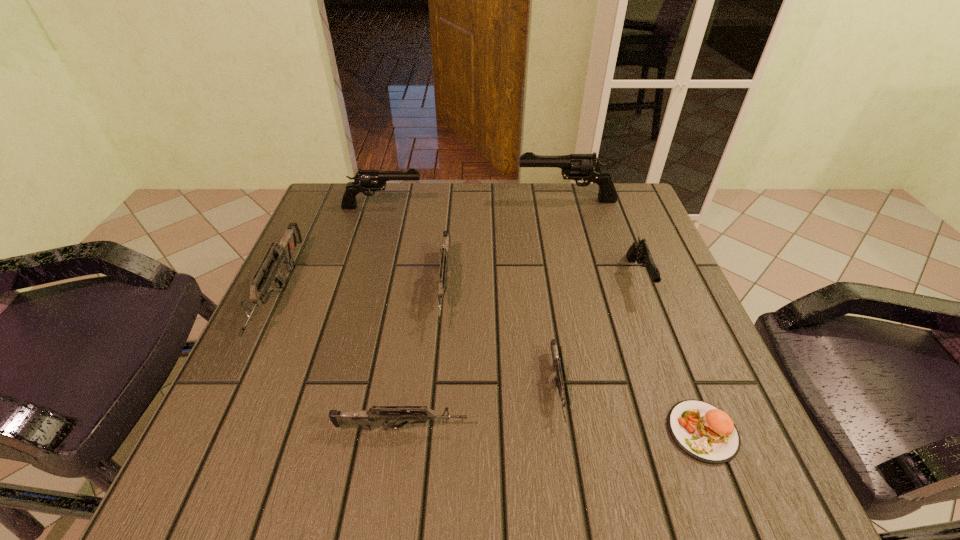
Where is `the biggest black gun`? The width and height of the screenshot is (960, 540). the biggest black gun is located at coordinates (587, 167).

This screenshot has height=540, width=960. In order to click on the tallest object in this screenshot , I will do `click(587, 167)`.

I want to click on the leftmost black gun, so click(365, 180).

The image size is (960, 540). I want to click on the leftmost object, so 282,252.

Locate an element on the screen. This screenshot has height=540, width=960. the leftmost grey gun is located at coordinates (282, 252).

Identify the location of the nearest black gun. (638, 251).

Image resolution: width=960 pixels, height=540 pixels. Find the location of `the third smallest grey gun`. the third smallest grey gun is located at coordinates pyautogui.click(x=445, y=249).

At what (x,y) coordinates should I click in order to perform the action: click on the second shortest gun. Please return your answer as a coordinate pair (x, y). Looking at the image, I should click on (389, 414).

Find the location of a particular element. This screenshot has height=540, width=960. the third shortest object is located at coordinates (389, 414).

Where is `the shortest gun`? The image size is (960, 540). the shortest gun is located at coordinates (559, 383).